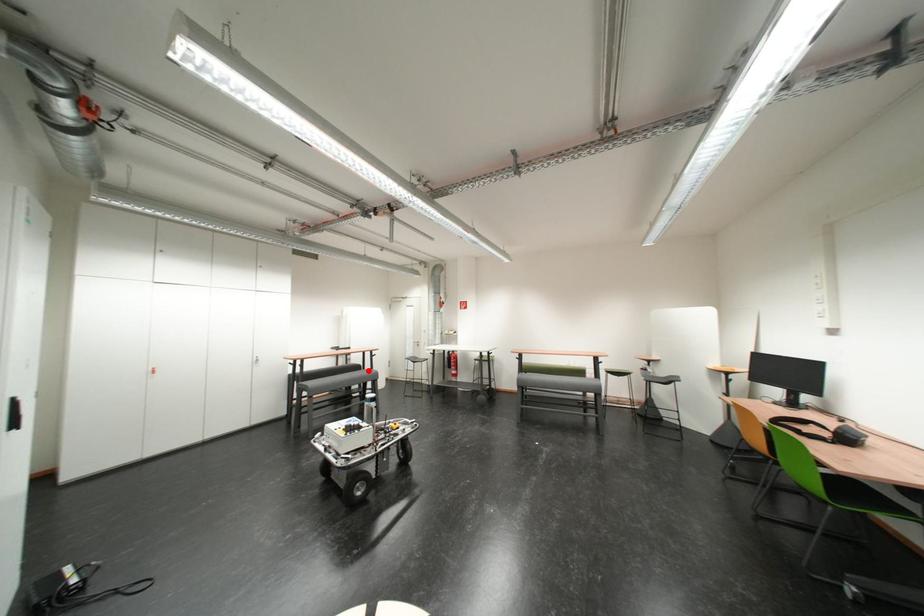
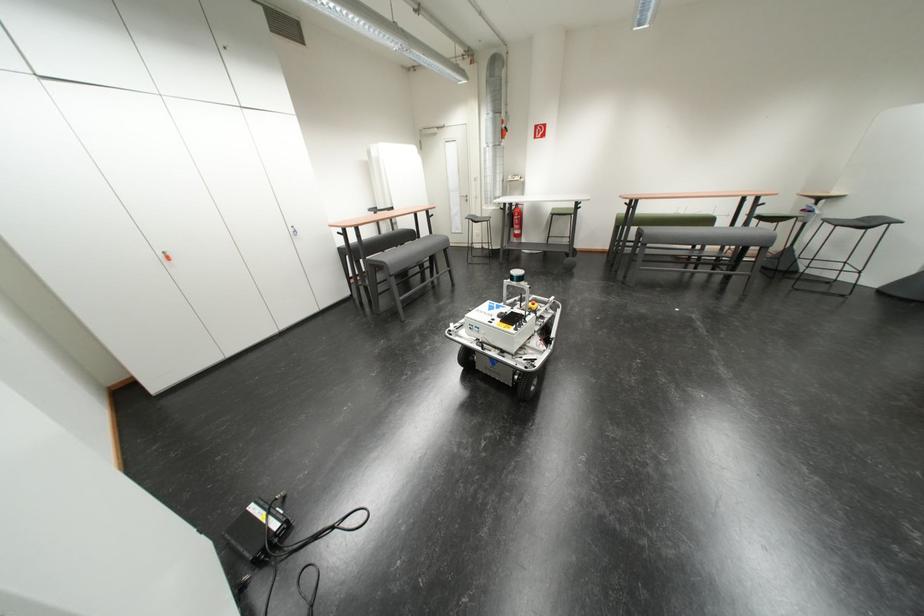
Locate, in the second image, the point that corresponds to the highlighted location in the first image.

(423, 237)